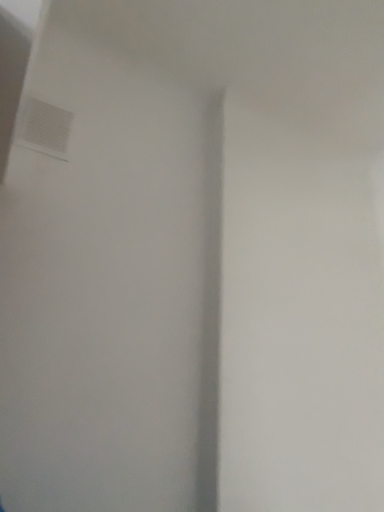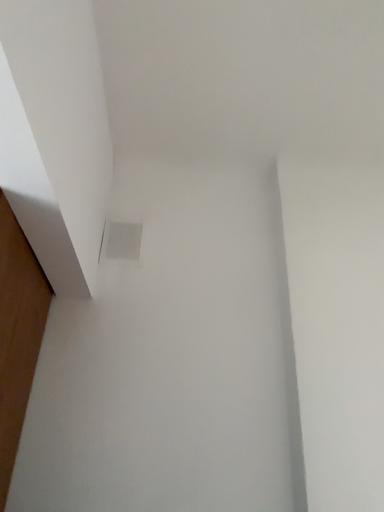
Question: Which way did the camera rotate in the video?

Choices:
 (A) rotated left
 (B) rotated right

Answer: (A)